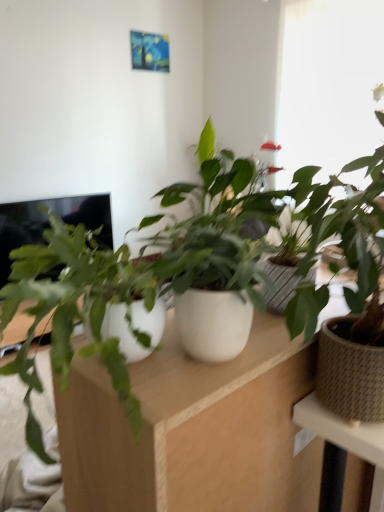
Question: Considering the relative sizes of transparent glass window at upper right and brown woven pot at right, the 1th houseplant viewed from the right, in the image provided, is transparent glass window at upper right wider than brown woven pot at right, the 1th houseplant viewed from the right,?

Choices:
 (A) no
 (B) yes

Answer: (B)

Question: Can you confirm if transparent glass window at upper right is thinner than brown woven pot at right, the 1th houseplant viewed from the right?

Choices:
 (A) no
 (B) yes

Answer: (A)

Question: From the image's perspective, is transparent glass window at upper right beneath brown woven pot at right, the 1th houseplant viewed from the right?

Choices:
 (A) no
 (B) yes

Answer: (A)

Question: Does transparent glass window at upper right appear on the left side of brown woven pot at right, the 2th houseplant in the left-to-right sequence?

Choices:
 (A) yes
 (B) no

Answer: (B)

Question: From a real-world perspective, is transparent glass window at upper right beneath brown woven pot at right, the 1th houseplant viewed from the right?

Choices:
 (A) yes
 (B) no

Answer: (B)

Question: Is transparent glass window at upper right smaller than brown woven pot at right, the 1th houseplant viewed from the right?

Choices:
 (A) yes
 (B) no

Answer: (B)

Question: From the image's perspective, is white matte pot at center, which ranks as the 1th houseplant in left-to-right order, on top of transparent glass window at upper right?

Choices:
 (A) no
 (B) yes

Answer: (A)

Question: Can you confirm if white matte pot at center, positioned as the 2th houseplant in right-to-left order, is positioned to the left of transparent glass window at upper right?

Choices:
 (A) yes
 (B) no

Answer: (A)

Question: Is white matte pot at center, positioned as the 2th houseplant in right-to-left order, positioned in front of transparent glass window at upper right?

Choices:
 (A) no
 (B) yes

Answer: (B)

Question: From a real-world perspective, is white matte pot at center, which ranks as the 1th houseplant in left-to-right order, under transparent glass window at upper right?

Choices:
 (A) no
 (B) yes

Answer: (B)

Question: Considering the relative sizes of white matte pot at center, positioned as the 2th houseplant in right-to-left order, and transparent glass window at upper right in the image provided, is white matte pot at center, positioned as the 2th houseplant in right-to-left order, smaller than transparent glass window at upper right?

Choices:
 (A) yes
 (B) no

Answer: (A)

Question: Does white matte pot at center, positioned as the 2th houseplant in right-to-left order, touch transparent glass window at upper right?

Choices:
 (A) no
 (B) yes

Answer: (A)

Question: From the image's perspective, is white matte computer desk at center located above black glossy screen at left?

Choices:
 (A) yes
 (B) no

Answer: (B)